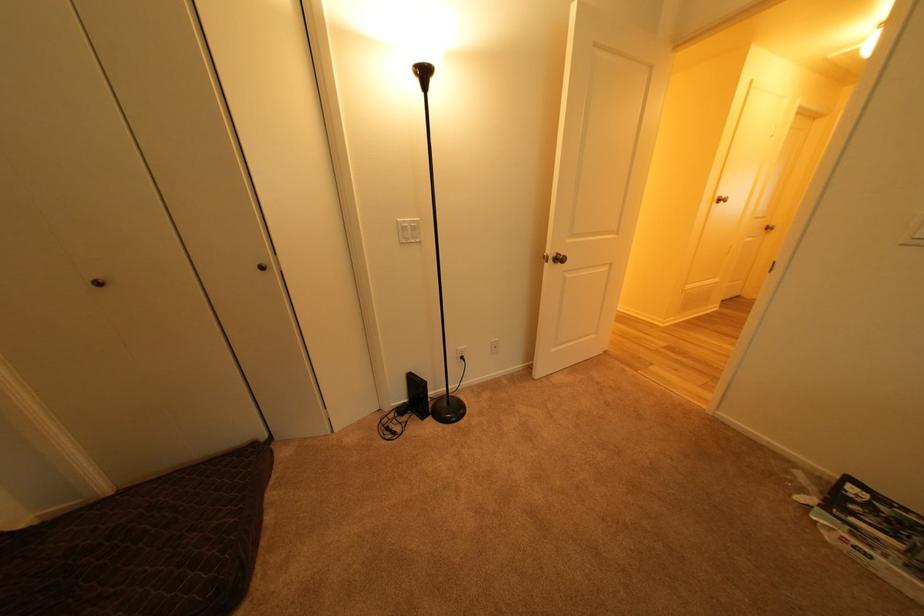
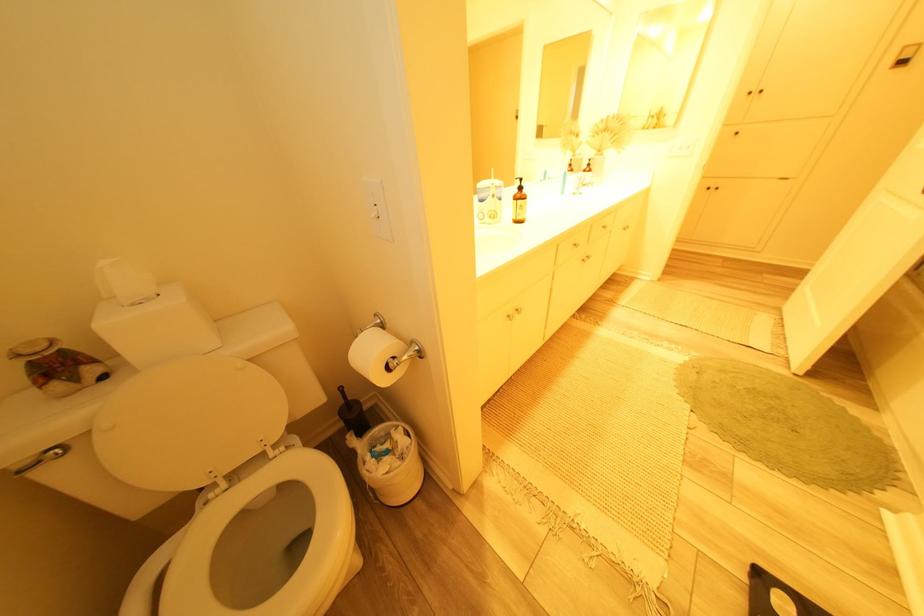
Which direction would the cameraman need to move to produce the second image?

The cameraman walked toward left, forward.